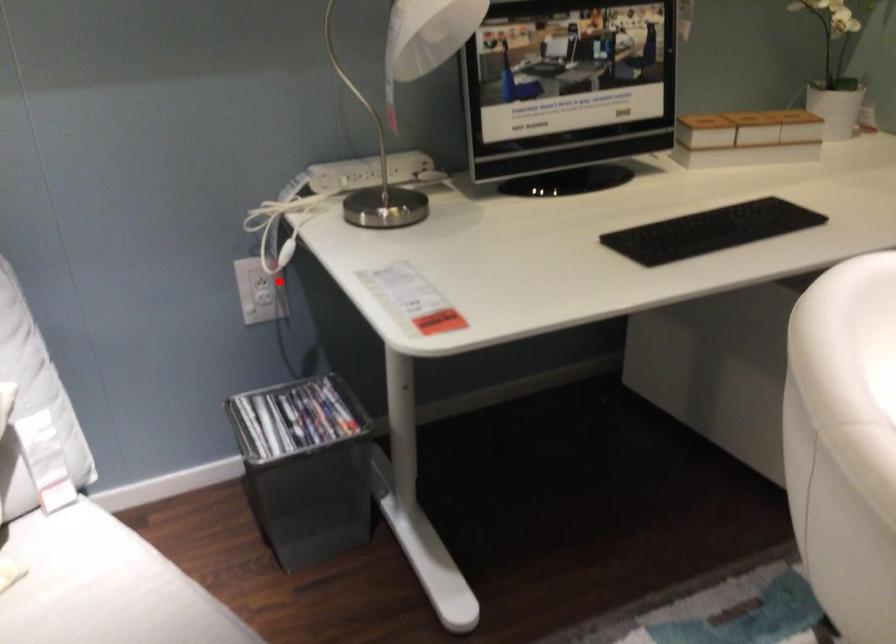
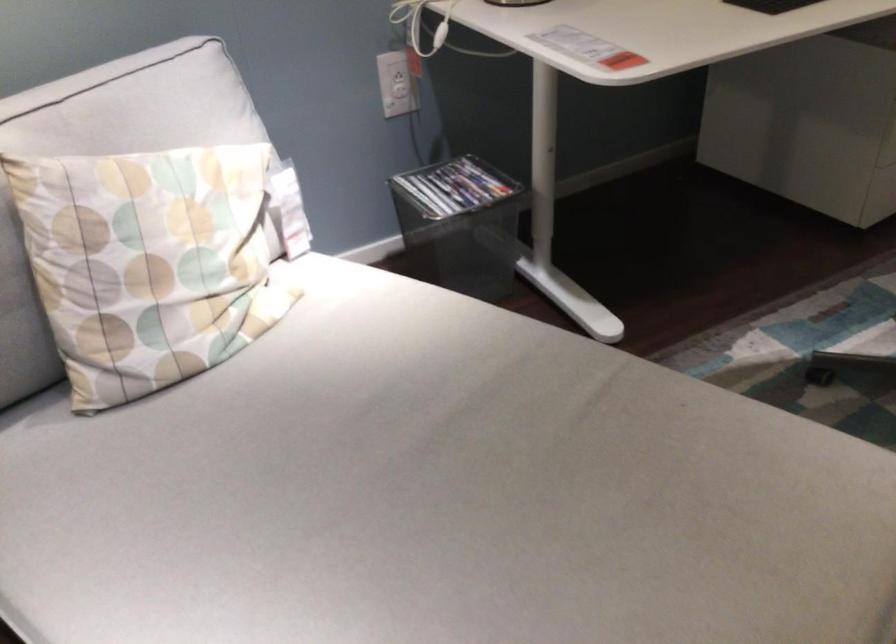
Question: I am providing you with two images of the same scene from different viewpoints. A red point is shown in image1. For the corresponding object point in image2, is it positioned nearer or farther from the camera?

Choices:
 (A) Nearer
 (B) Farther

Answer: (B)